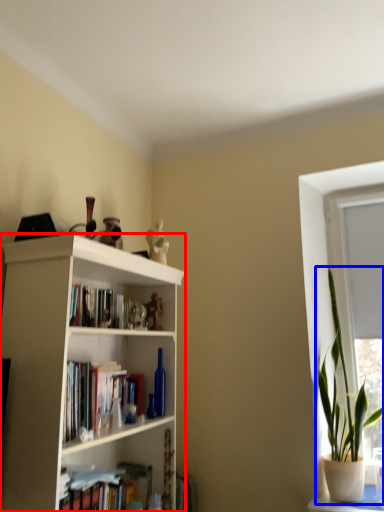
Question: Which object appears farthest to the camera in this image, bookcase (highlighted by a red box) or houseplant (highlighted by a blue box)?

Choices:
 (A) bookcase
 (B) houseplant

Answer: (B)